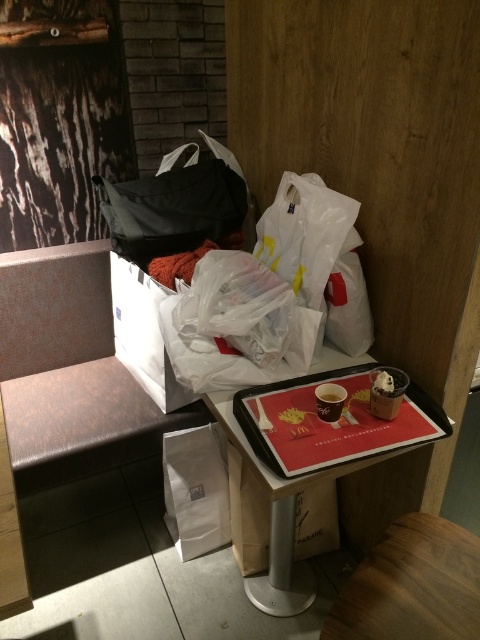
Can you confirm if wooden stool at lower right is taller than cardboard tray at center?

Incorrect, wooden stool at lower right's height is not larger of cardboard tray at center's.

Does wooden stool at lower right have a greater width compared to cardboard tray at center?

Correct, the width of wooden stool at lower right exceeds that of cardboard tray at center.

Who is more forward, (x=352, y=602) or (x=263, y=586)?

Point (x=352, y=602) is in front.

Where is `wooden stool at lower right`? wooden stool at lower right is located at coordinates (411, 586).

Does wooden stool at lower right come in front of red matte tray at center?

Yes, it is in front of red matte tray at center.

Can you confirm if wooden stool at lower right is taller than red matte tray at center?

No, wooden stool at lower right is not taller than red matte tray at center.

The image size is (480, 640). Describe the element at coordinates (411, 586) in the screenshot. I see `wooden stool at lower right` at that location.

Locate an element on the screen. This screenshot has height=640, width=480. wooden stool at lower right is located at coordinates (411, 586).

Identify the location of red matte tray at center. The height and width of the screenshot is (640, 480). (331, 422).

Is point (308, 419) closer to viewer compared to point (283, 419)?

No, (308, 419) is further to viewer.

Identify the location of red matte tray at center. (331, 422).